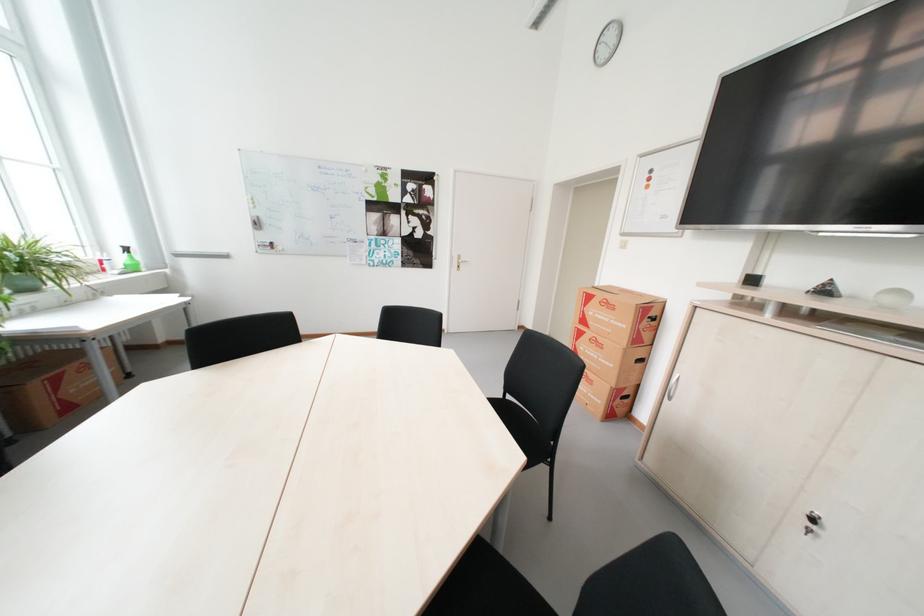
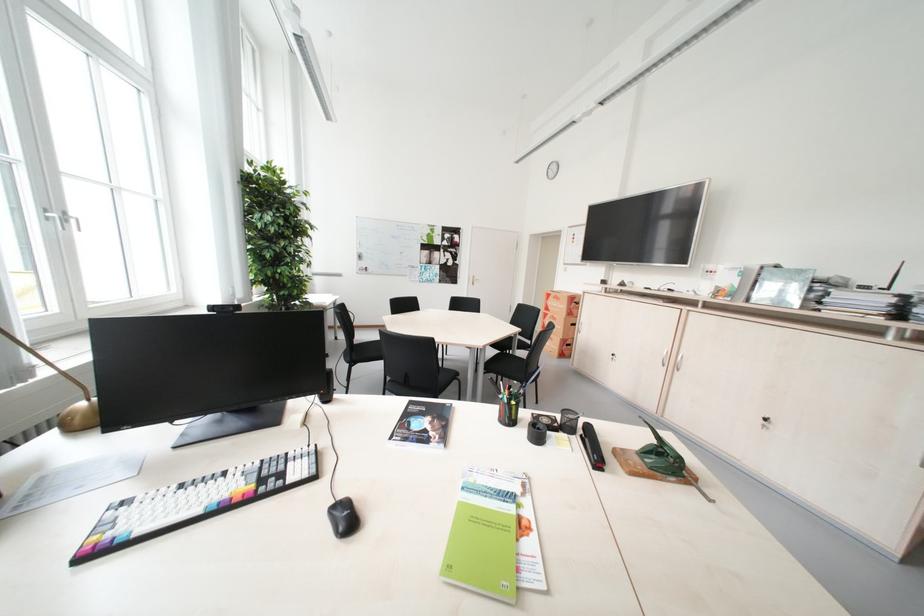
The point at (604, 302) is marked in the first image. Where is the corresponding point in the second image?

(561, 299)